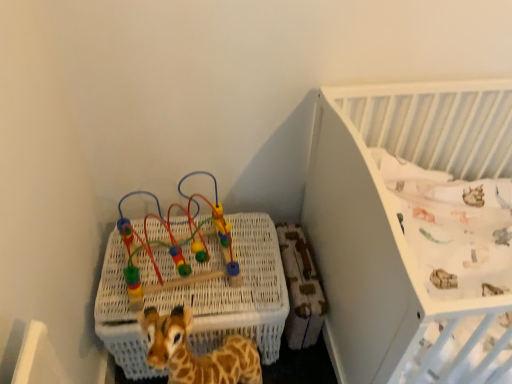
Question: Does white textured crib at upper right appear on the right side of multicolored plastic bead maze at upper left?

Choices:
 (A) no
 (B) yes

Answer: (B)

Question: Considering the relative sizes of white textured crib at upper right and multicolored plastic bead maze at upper left in the image provided, is white textured crib at upper right bigger than multicolored plastic bead maze at upper left?

Choices:
 (A) no
 (B) yes

Answer: (B)

Question: Is multicolored plastic bead maze at upper left completely or partially inside white textured crib at upper right?

Choices:
 (A) no
 (B) yes

Answer: (A)

Question: Considering the relative sizes of white textured crib at upper right and multicolored plastic bead maze at upper left in the image provided, is white textured crib at upper right smaller than multicolored plastic bead maze at upper left?

Choices:
 (A) no
 (B) yes

Answer: (A)

Question: From the image's perspective, would you say white textured crib at upper right is positioned over multicolored plastic bead maze at upper left?

Choices:
 (A) yes
 (B) no

Answer: (B)

Question: Is multicolored plastic bead maze at upper left at the back of white textured crib at upper right?

Choices:
 (A) no
 (B) yes

Answer: (A)

Question: Considering the relative sizes of multicolored plastic bead maze at upper left and white textured crib at upper right in the image provided, is multicolored plastic bead maze at upper left bigger than white textured crib at upper right?

Choices:
 (A) yes
 (B) no

Answer: (B)

Question: Can you confirm if multicolored plastic bead maze at upper left is thinner than white textured crib at upper right?

Choices:
 (A) no
 (B) yes

Answer: (B)

Question: Is multicolored plastic bead maze at upper left not close to white textured crib at upper right?

Choices:
 (A) yes
 (B) no

Answer: (B)

Question: Is multicolored plastic bead maze at upper left shorter than white textured crib at upper right?

Choices:
 (A) no
 (B) yes

Answer: (B)

Question: From the image's perspective, is multicolored plastic bead maze at upper left on white textured crib at upper right?

Choices:
 (A) no
 (B) yes

Answer: (B)

Question: Is multicolored plastic bead maze at upper left outside of white textured crib at upper right?

Choices:
 (A) yes
 (B) no

Answer: (A)

Question: Does white textured crib at upper right appear on the left side of white wicker basket at lower left?

Choices:
 (A) yes
 (B) no

Answer: (B)